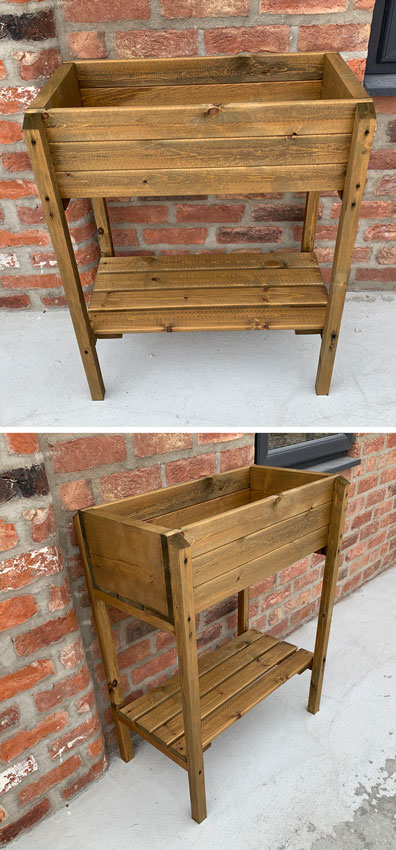
This screenshot has height=850, width=396. In order to click on table leg in this screenshot , I will do `click(194, 773)`.